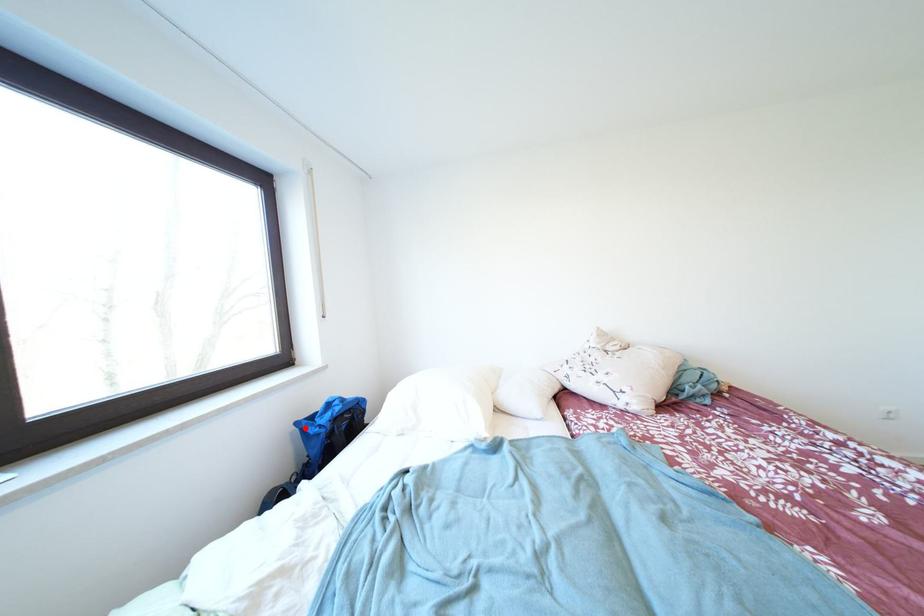
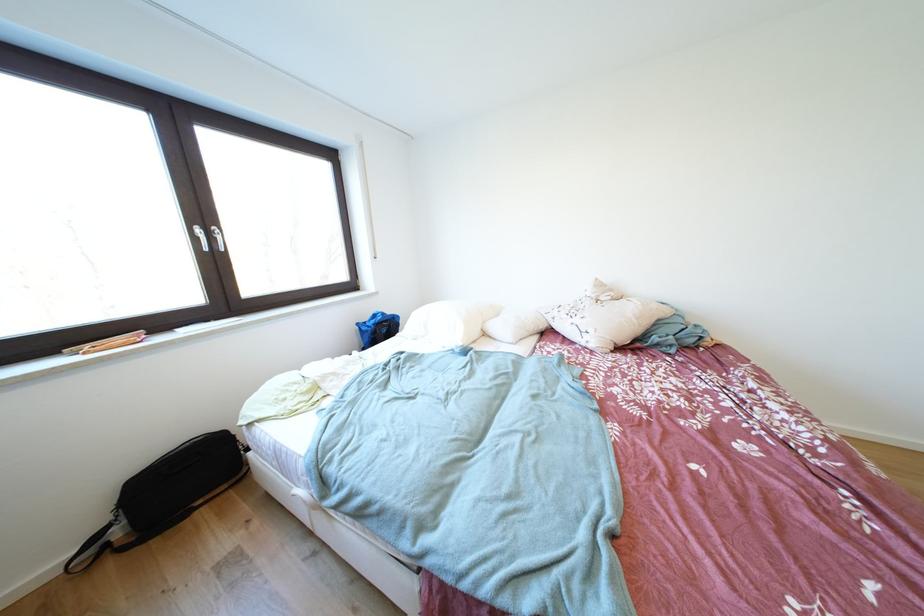
Question: I am providing you with two images of the same scene from different viewpoints. Image1 has a red point marked. In image2, the corresponding 3D location appears at what relative position? Reply with the corresponding letter.

Choices:
 (A) Closer
 (B) Farther

Answer: (A)